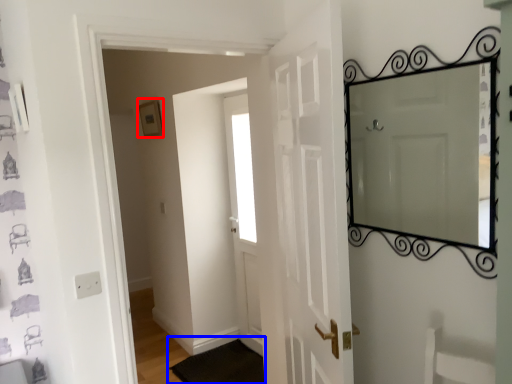
Question: Among these objects, which one is farthest to the camera, picture frame (highlighted by a red box) or doormat (highlighted by a blue box)?

Choices:
 (A) picture frame
 (B) doormat

Answer: (A)